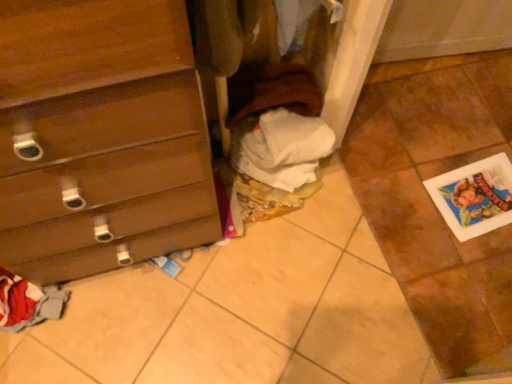
Question: Considering their positions, is wooden chest of drawers at left located in front of or behind brown cotton sweater at center?

Choices:
 (A) front
 (B) behind

Answer: (A)

Question: Looking at the image, does wooden chest of drawers at left seem bigger or smaller compared to brown cotton sweater at center?

Choices:
 (A) big
 (B) small

Answer: (A)

Question: Which of these objects is positioned farthest from the white paper at lower right?

Choices:
 (A) wooden chest of drawers at left
 (B) brown cotton sweater at center

Answer: (A)

Question: Estimate the real-world distances between objects in this image. Which object is closer to the white paper at lower right?

Choices:
 (A) wooden chest of drawers at left
 (B) brown cotton sweater at center

Answer: (B)